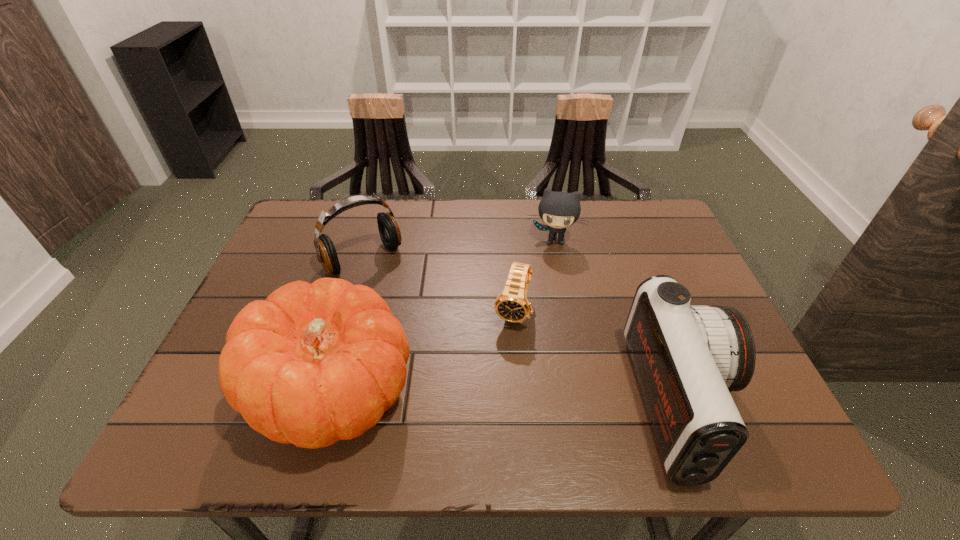
This screenshot has width=960, height=540. Identify the location of free space on the desktop that is between the pumpkin and the rightmost object and is positioned on the front-facing side of the second object from right to left. (539, 400).

Locate an element on the screen. Image resolution: width=960 pixels, height=540 pixels. free space on the desktop that is between the pumpkin and the camcorder and is positioned on the face of the third object from left to right is located at coordinates (488, 397).

Where is `free space on the desktop that is between the pumpkin and the camcorder and is positioned on the ear cups of the headset`? This screenshot has height=540, width=960. free space on the desktop that is between the pumpkin and the camcorder and is positioned on the ear cups of the headset is located at coordinates (478, 397).